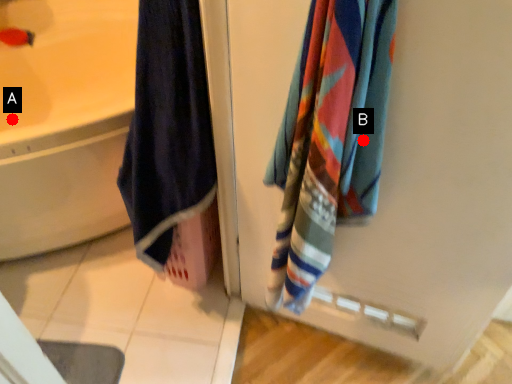
Question: Two points are circled on the image, labeled by A and B beside each circle. Among these points, which one is nearest to the camera?

Choices:
 (A) A is closer
 (B) B is closer

Answer: (B)